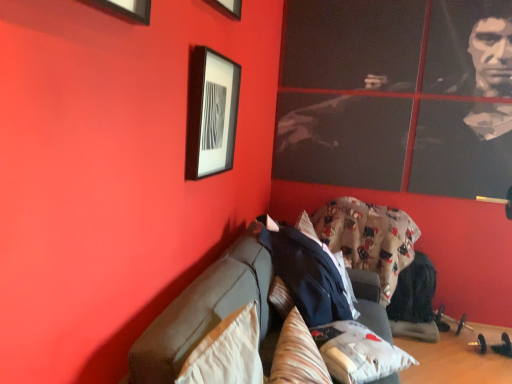
Question: From a real-world perspective, is beige fabric pillow at lower left, which is the third pillow from right to left, physically below fluffy white pillow at lower center, the 3th pillow from the left?

Choices:
 (A) yes
 (B) no

Answer: (B)

Question: From the image's perspective, is beige fabric pillow at lower left, placed as the 1th pillow when sorted from left to right, above fluffy white pillow at lower center, positioned as the first pillow in right-to-left order?

Choices:
 (A) yes
 (B) no

Answer: (A)

Question: From the image's perspective, is beige fabric pillow at lower left, which is the third pillow from right to left, beneath fluffy white pillow at lower center, positioned as the first pillow in right-to-left order?

Choices:
 (A) yes
 (B) no

Answer: (B)

Question: Is beige fabric pillow at lower left, placed as the 1th pillow when sorted from left to right, oriented towards fluffy white pillow at lower center, positioned as the first pillow in right-to-left order?

Choices:
 (A) yes
 (B) no

Answer: (B)

Question: Does beige fabric pillow at lower left, which is the third pillow from right to left, have a lesser height compared to fluffy white pillow at lower center, the 3th pillow from the left?

Choices:
 (A) yes
 (B) no

Answer: (B)

Question: Is beige fabric pillow at lower left, which is the third pillow from right to left, in front of or behind matte black picture frame at upper left in the image?

Choices:
 (A) front
 (B) behind

Answer: (A)

Question: From a real-world perspective, is beige fabric pillow at lower left, placed as the 1th pillow when sorted from left to right, positioned above or below matte black picture frame at upper left?

Choices:
 (A) below
 (B) above

Answer: (A)

Question: Considering the relative positions of beige fabric pillow at lower left, which is the third pillow from right to left, and matte black picture frame at upper left in the image provided, is beige fabric pillow at lower left, which is the third pillow from right to left, to the left or to the right of matte black picture frame at upper left?

Choices:
 (A) right
 (B) left

Answer: (A)

Question: Is beige fabric pillow at lower left, which is the third pillow from right to left, taller or shorter than matte black picture frame at upper left?

Choices:
 (A) short
 (B) tall

Answer: (A)

Question: Visually, is dark gray fabric couch at center positioned to the left or to the right of fluffy cotton blanket at center?

Choices:
 (A) left
 (B) right

Answer: (A)

Question: From their relative heights in the image, would you say dark gray fabric couch at center is taller or shorter than fluffy cotton blanket at center?

Choices:
 (A) short
 (B) tall

Answer: (A)

Question: Considering the positions of dark gray fabric couch at center and fluffy cotton blanket at center in the image, is dark gray fabric couch at center wider or thinner than fluffy cotton blanket at center?

Choices:
 (A) wide
 (B) thin

Answer: (A)

Question: From the image's perspective, is dark gray fabric couch at center above or below fluffy cotton blanket at center?

Choices:
 (A) below
 (B) above

Answer: (A)

Question: Is matte black picture frame at upper left to the left or to the right of fluffy white pillow at lower center, the 3th pillow from the left, in the image?

Choices:
 (A) right
 (B) left

Answer: (B)

Question: In terms of width, does matte black picture frame at upper left look wider or thinner when compared to fluffy white pillow at lower center, the 3th pillow from the left?

Choices:
 (A) thin
 (B) wide

Answer: (A)